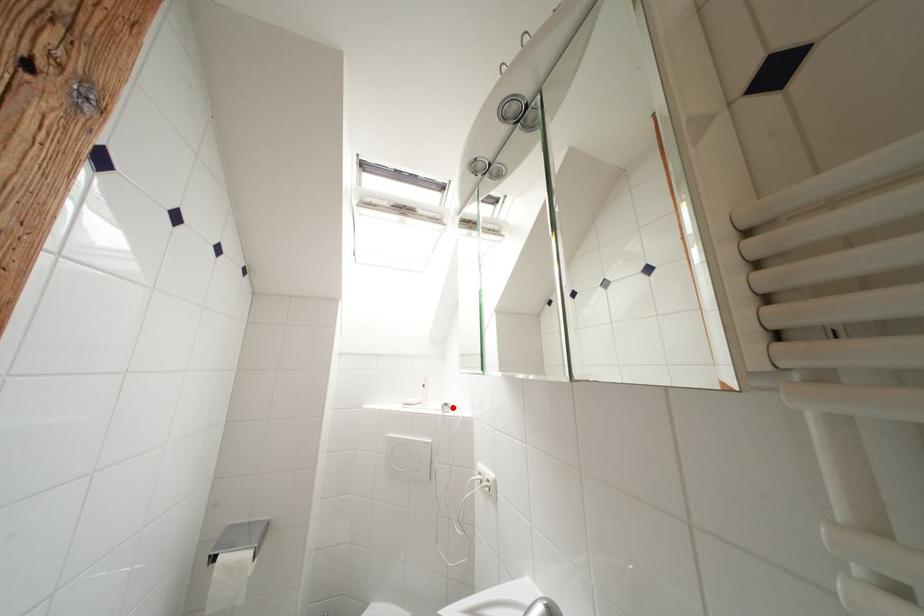
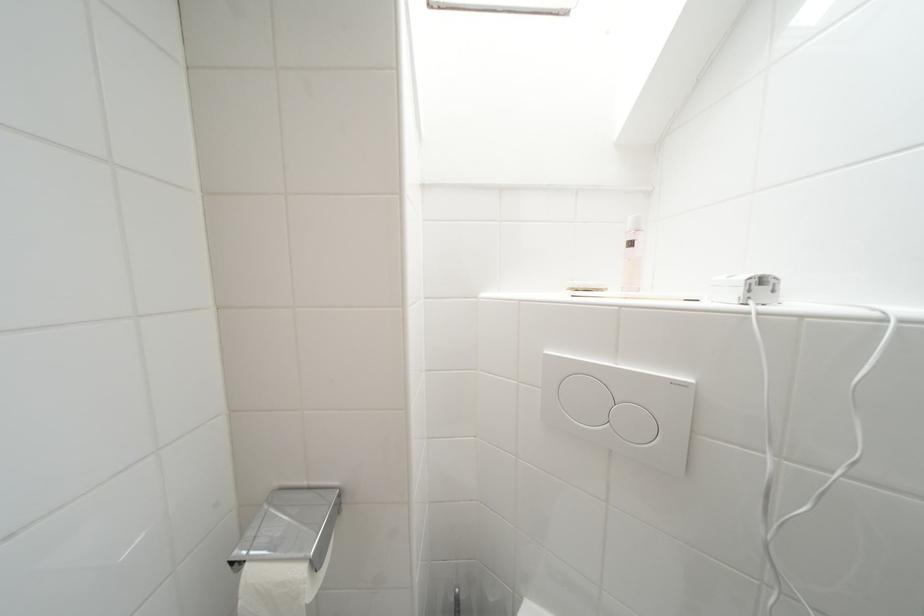
Find the pixel in the second image that matches the highlighted location in the first image.

(769, 283)